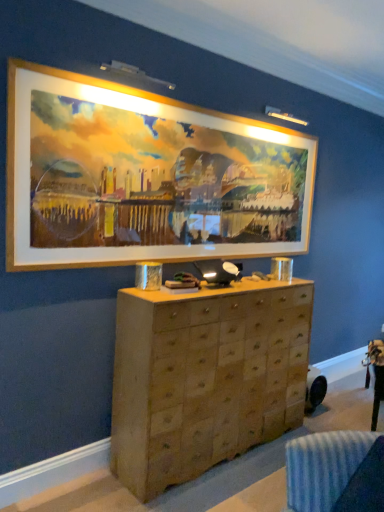
Question: Does wooden frame at upper center have a smaller size compared to wooden chest of drawers at center?

Choices:
 (A) yes
 (B) no

Answer: (A)

Question: From the image's perspective, is wooden frame at upper center under wooden chest of drawers at center?

Choices:
 (A) no
 (B) yes

Answer: (A)

Question: From a real-world perspective, is wooden frame at upper center below wooden chest of drawers at center?

Choices:
 (A) yes
 (B) no

Answer: (B)

Question: Considering the relative sizes of wooden frame at upper center and wooden chest of drawers at center in the image provided, is wooden frame at upper center bigger than wooden chest of drawers at center?

Choices:
 (A) yes
 (B) no

Answer: (B)

Question: Is the position of wooden frame at upper center less distant than that of wooden chest of drawers at center?

Choices:
 (A) no
 (B) yes

Answer: (B)

Question: Is wooden frame at upper center not inside wooden chest of drawers at center?

Choices:
 (A) no
 (B) yes

Answer: (B)

Question: Can you confirm if wooden chest of drawers at center is shorter than wooden frame at upper center?

Choices:
 (A) yes
 (B) no

Answer: (B)

Question: Is wooden chest of drawers at center far from wooden frame at upper center?

Choices:
 (A) no
 (B) yes

Answer: (A)

Question: Could wooden frame at upper center be considered to be inside wooden chest of drawers at center?

Choices:
 (A) yes
 (B) no

Answer: (B)

Question: Is wooden chest of drawers at center positioned before wooden frame at upper center?

Choices:
 (A) yes
 (B) no

Answer: (B)

Question: Can you confirm if wooden chest of drawers at center is thinner than wooden frame at upper center?

Choices:
 (A) no
 (B) yes

Answer: (A)

Question: From the image's perspective, would you say wooden chest of drawers at center is positioned over wooden frame at upper center?

Choices:
 (A) no
 (B) yes

Answer: (A)

Question: In terms of width, does wooden chest of drawers at center look wider or thinner when compared to wooden frame at upper center?

Choices:
 (A) wide
 (B) thin

Answer: (A)